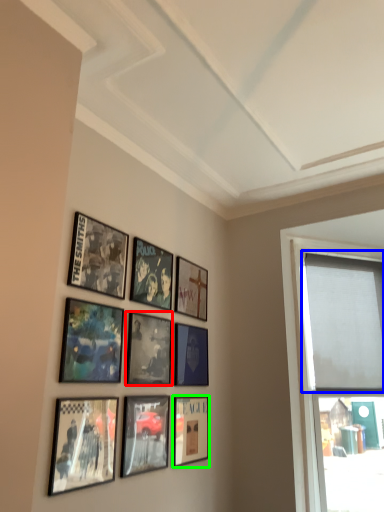
Question: Which is nearer to the picture frame (highlighted by a red box)? window screen (highlighted by a blue box) or picture frame (highlighted by a green box).

Choices:
 (A) window screen
 (B) picture frame

Answer: (B)